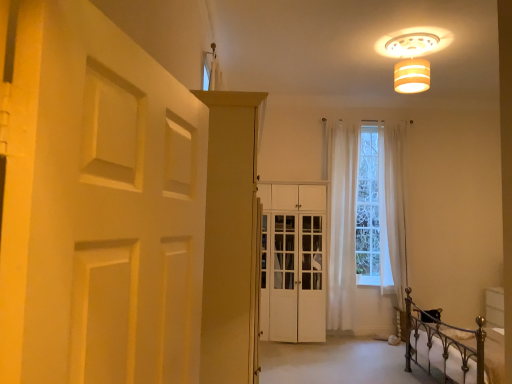
Question: Could you tell me if matte white cabinet at center, which is the 1th door from front to back, is turned towards white sheer curtain at center, arranged as the 2th curtain when viewed from the left?

Choices:
 (A) yes
 (B) no

Answer: (B)

Question: Is matte white cabinet at center, placed as the 2th door when sorted from right to left, placed right next to white sheer curtain at center, arranged as the 2th curtain when viewed from the left?

Choices:
 (A) no
 (B) yes

Answer: (A)

Question: From the image's perspective, is matte white cabinet at center, which is the 1th door from front to back, below white sheer curtain at center, arranged as the 2th curtain when viewed from the left?

Choices:
 (A) yes
 (B) no

Answer: (A)

Question: Is matte white cabinet at center, which is the 1th door from front to back, in front of white sheer curtain at center, arranged as the 2th curtain when viewed from the left?

Choices:
 (A) yes
 (B) no

Answer: (A)

Question: Is matte white cabinet at center, which is the 1th door from front to back, not within white sheer curtain at center, arranged as the 2th curtain when viewed from the left?

Choices:
 (A) yes
 (B) no

Answer: (A)

Question: Considering the positions of point (292, 309) and point (484, 380), is point (292, 309) closer or farther from the camera than point (484, 380)?

Choices:
 (A) farther
 (B) closer

Answer: (A)

Question: From a real-world perspective, relative to metallic wrought iron bed at lower right, is white wood cabinet at center, positioned as the first door in right-to-left order, vertically above or below?

Choices:
 (A) above
 (B) below

Answer: (A)

Question: In the image, is white wood cabinet at center, the 2th door positioned from the left, positioned in front of or behind metallic wrought iron bed at lower right?

Choices:
 (A) behind
 (B) front

Answer: (A)

Question: From the image's perspective, is white wood cabinet at center, the 2th door positioned from the left, located above or below metallic wrought iron bed at lower right?

Choices:
 (A) below
 (B) above

Answer: (B)

Question: Considering the positions of white matte door at left and white sheer curtain at center, the 1th curtain when ordered from right to left, in the image, is white matte door at left taller or shorter than white sheer curtain at center, the 1th curtain when ordered from right to left,?

Choices:
 (A) tall
 (B) short

Answer: (B)

Question: Is white matte door at left bigger or smaller than white sheer curtain at center, arranged as the 2th curtain when viewed from the left?

Choices:
 (A) small
 (B) big

Answer: (A)

Question: In the image, is white matte door at left on the left side or the right side of white sheer curtain at center, the 1th curtain when ordered from right to left?

Choices:
 (A) right
 (B) left

Answer: (B)

Question: Does point click(x=172, y=238) appear closer or farther from the camera than point click(x=386, y=155)?

Choices:
 (A) closer
 (B) farther

Answer: (A)

Question: Considering the positions of point (148, 142) and point (340, 296), is point (148, 142) closer or farther from the camera than point (340, 296)?

Choices:
 (A) farther
 (B) closer

Answer: (B)

Question: From a real-world perspective, relative to white sheer curtain at center, the 1th curtain in the left-to-right sequence, is white matte door at left vertically above or below?

Choices:
 (A) below
 (B) above

Answer: (A)